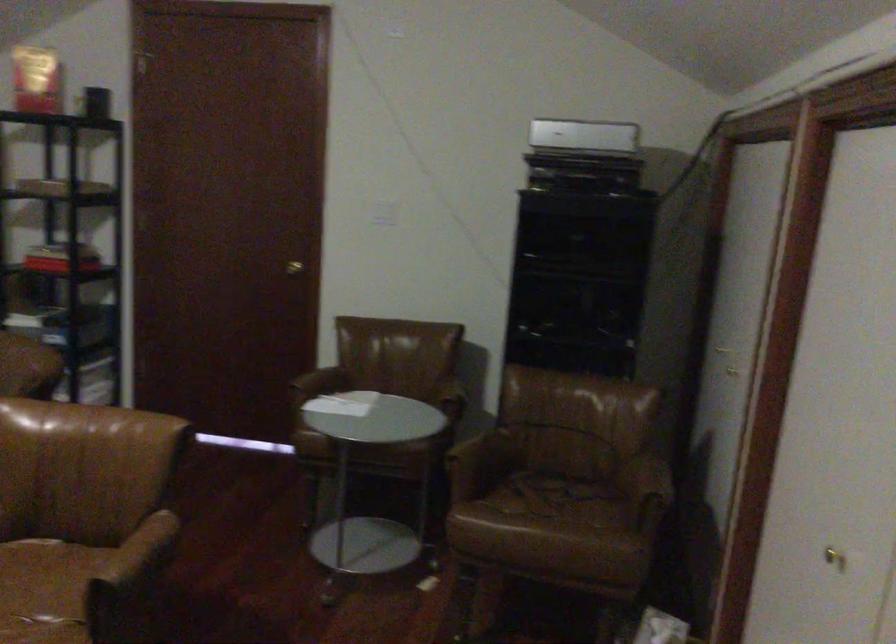
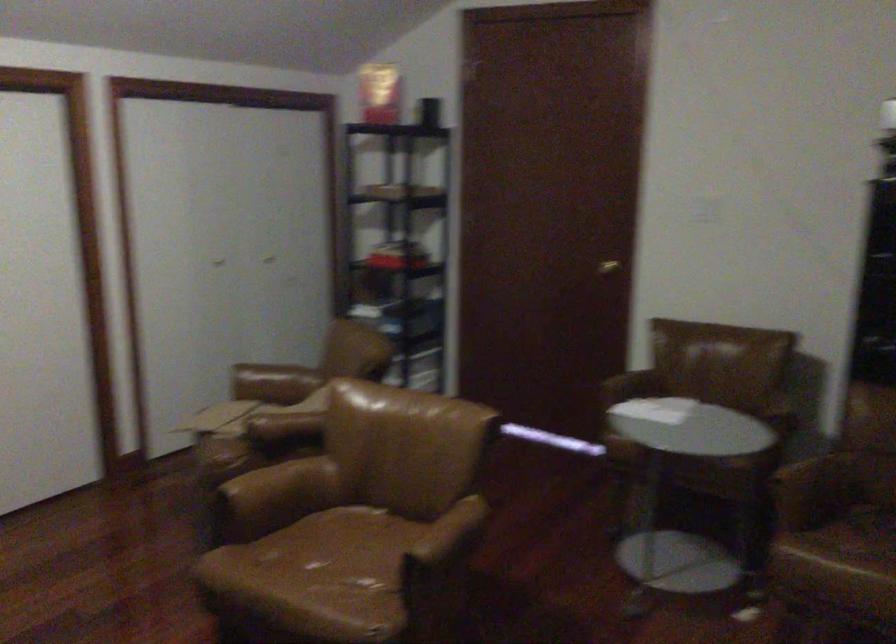
The images are taken continuously from a first-person perspective. In which direction are you moving?

The cameraman moved toward right, forward.